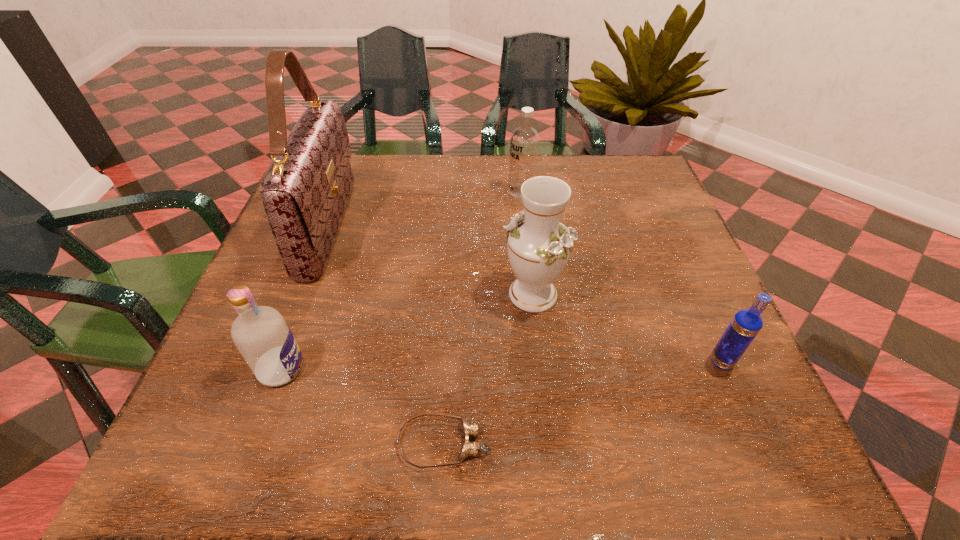
Identify the location of vacant space located 0.230m on the front label of the second vodka from left to right. (419, 192).

At what (x,y) coordinates should I click in order to perform the action: click on vacant region located 0.260m on the front label of the second vodka from left to right. Please return your answer as a coordinate pair (x, y). Looking at the image, I should click on (407, 192).

Locate an element on the screen. The width and height of the screenshot is (960, 540). vacant point located on the front label of the second vodka from left to right is located at coordinates (365, 192).

Find the location of `free point located 0.280m on the label of the leftmost vodka`. free point located 0.280m on the label of the leftmost vodka is located at coordinates (465, 369).

Locate an element on the screen. free location located on the back of the second shortest object is located at coordinates (700, 313).

This screenshot has width=960, height=540. I want to click on blank space located 0.340m on the front lenses and sides of the shortest object, so click(709, 443).

Identify the location of handbag that is at the far edge. This screenshot has height=540, width=960. (305, 191).

This screenshot has width=960, height=540. I want to click on vodka at the far edge, so click(525, 140).

This screenshot has width=960, height=540. In order to click on object present at the near edge in this screenshot , I will do `click(470, 430)`.

Where is `handbag that is at the left edge`? This screenshot has width=960, height=540. handbag that is at the left edge is located at coordinates (305, 191).